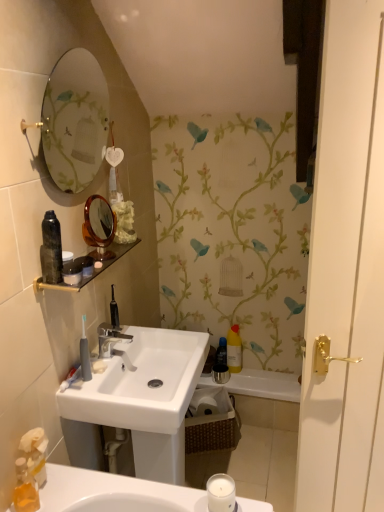
Identify the location of yellow matte bottle at center, marked as the 1th toiletry in a right-to-left arrangement. (234, 350).

Find the location of a particular element. gray rubber toothbrush at lower left, which is the first toiletry from top to bottom is located at coordinates (85, 354).

What do you see at coordinates (92, 272) in the screenshot?
I see `matte glass shelf at upper center` at bounding box center [92, 272].

Where is `translucent plastic soap dispenser at lower left`? translucent plastic soap dispenser at lower left is located at coordinates (25, 488).

You are a GUI agent. You are given a task and a screenshot of the screen. Output one action in this format:
    pyautogui.click(x=<x>, y=<y>)
    Task: Click on the white glossy door handle at right
    The height and width of the screenshot is (512, 384).
    Given the screenshot: What is the action you would take?
    pyautogui.click(x=346, y=271)

What is the approximate height of white glossy door handle at right?

white glossy door handle at right is 1.66 meters in height.

I want to click on yellow matte bottle at center, which ranks as the 2th toiletry in top-to-bottom order, so click(x=234, y=350).

The image size is (384, 512). What are the coordinates of `basket on the right of the silver metallic faucet at center` in the screenshot? It's located at (210, 432).

Would you say silver metallic faucet at center is to the left or to the right of woven brown basket at lower center in the picture?

In the image, silver metallic faucet at center appears on the left side of woven brown basket at lower center.

Is silver metallic faucet at center wider or thinner than woven brown basket at lower center?

silver metallic faucet at center is thinner than woven brown basket at lower center.

Is silver metallic faucet at center smaller than woven brown basket at lower center?

Yes, silver metallic faucet at center is smaller than woven brown basket at lower center.

Between satin gold mirror at upper center and white glossy bathtub at center, which one appears on the left side from the viewer's perspective?

Positioned to the left is satin gold mirror at upper center.

You are a GUI agent. You are given a task and a screenshot of the screen. Output one action in this format:
    pyautogui.click(x=<x>, y=<y>)
    Task: Click on the mirror above the white glossy bathtub at center (from a real-world perspective)
    The height and width of the screenshot is (512, 384).
    Given the screenshot: What is the action you would take?
    pyautogui.click(x=99, y=226)

Is satin gold mirror at upper center facing away from white glossy bathtub at center?

That's not correct — satin gold mirror at upper center is not looking away from white glossy bathtub at center.

Does satin gold mirror at upper center come in front of white glossy bathtub at center?

Yes, it is in front of white glossy bathtub at center.

Is white matte candle at lower center far away from white glossy sink at center?

That's not correct — white matte candle at lower center is a little close to white glossy sink at center.

Consider the image. Looking at the image, does white matte candle at lower center seem bigger or smaller compared to white glossy sink at center?

white matte candle at lower center is smaller than white glossy sink at center.

From the image's perspective, which one is positioned lower, white matte candle at lower center or white glossy sink at center?

white glossy sink at center.

Considering the relative sizes of white matte candle at lower center and white glossy sink at center in the image provided, is white matte candle at lower center wider than white glossy sink at center?

Incorrect, the width of white matte candle at lower center does not surpass that of white glossy sink at center.

Is there a large distance between matte glass shelf at upper center and translucent plastic soap dispenser at lower left?

No, matte glass shelf at upper center is not far away from translucent plastic soap dispenser at lower left.

Which of these two, matte glass shelf at upper center or translucent plastic soap dispenser at lower left, stands taller?

translucent plastic soap dispenser at lower left is taller.

Is matte glass shelf at upper center to the left or to the right of translucent plastic soap dispenser at lower left in the image?

Based on their positions, matte glass shelf at upper center is located to the right of translucent plastic soap dispenser at lower left.

Considering the points (84, 285) and (19, 496), which point is in front, point (84, 285) or point (19, 496)?

The point (19, 496) is in front.

How far apart are gray rubber toothbrush at lower left, the 2th toiletry in the right-to-left sequence, and translucent plastic soap dispenser at lower left?

The distance of gray rubber toothbrush at lower left, the 2th toiletry in the right-to-left sequence, from translucent plastic soap dispenser at lower left is 15.16 inches.

Can we say gray rubber toothbrush at lower left, which is counted as the second toiletry, starting from the back, lies outside translucent plastic soap dispenser at lower left?

Yes, gray rubber toothbrush at lower left, which is counted as the second toiletry, starting from the back, is outside of translucent plastic soap dispenser at lower left.

From the image's perspective, which one is positioned higher, gray rubber toothbrush at lower left, arranged as the second toiletry when ordered from the bottom, or translucent plastic soap dispenser at lower left?

From the image's view, gray rubber toothbrush at lower left, arranged as the second toiletry when ordered from the bottom, is above.

Find the location of `the 1st toiletry to the right when counting from the translucent plastic soap dispenser at lower left`. the 1st toiletry to the right when counting from the translucent plastic soap dispenser at lower left is located at coordinates (85, 354).

From a real-world perspective, which object stands above the other?

matte glass shelf at upper center, from a real-world perspective.

Who is bigger, white matte candle at lower center or matte glass shelf at upper center?

Bigger between the two is matte glass shelf at upper center.

Consider the image. How distant is white matte candle at lower center from matte glass shelf at upper center?

white matte candle at lower center is 31.71 inches away from matte glass shelf at upper center.

Could you tell me if white matte candle at lower center is turned towards matte glass shelf at upper center?

No, white matte candle at lower center is not turned towards matte glass shelf at upper center.

From a real-world perspective, is white glossy door handle at right positioned over white matte candle at lower center based on gravity?

Correct, in the physical world, white glossy door handle at right is higher than white matte candle at lower center.

From the image's perspective, is white glossy door handle at right under white matte candle at lower center?

Actually, white glossy door handle at right appears above white matte candle at lower center in the image.

Do you think white glossy door handle at right is within white matte candle at lower center, or outside of it?

The correct answer is: outside.

Between white glossy door handle at right and white matte candle at lower center, which one has less height?

With less height is white matte candle at lower center.

Locate an element on the screen. The width and height of the screenshot is (384, 512). tap above the woven brown basket at lower center (from the image's perspective) is located at coordinates (110, 339).

Where is `mirror on the left of white glossy bathtub at center`? Image resolution: width=384 pixels, height=512 pixels. mirror on the left of white glossy bathtub at center is located at coordinates tap(99, 226).

Considering their positions, is white glossy sink at center positioned closer to white glossy door handle at right than gray rubber toothbrush at lower left, the 2th toiletry in the right-to-left sequence?

The object closer to white glossy door handle at right is white glossy sink at center.

From the image, which object appears to be farther from white glossy sink at center, white glossy bathtub at center or matte glass shelf at upper center?

white glossy bathtub at center lies further to white glossy sink at center than the other object.

Estimate the real-world distances between objects in this image. Which object is further from translucent plastic soap dispenser at lower left, yellow matte bottle at center, which ranks as the 2th toiletry in top-to-bottom order, or white glossy bathtub at center?

The object further to translucent plastic soap dispenser at lower left is yellow matte bottle at center, which ranks as the 2th toiletry in top-to-bottom order.

Consider the image. Considering their positions, is white glossy sink at center positioned further to translucent plastic soap dispenser at lower left than white glossy door handle at right?

white glossy door handle at right is further to translucent plastic soap dispenser at lower left.

Considering their positions, is woven brown basket at lower center positioned closer to white glossy sink at center than gray rubber toothbrush at lower left, marked as the first toiletry in a front-to-back arrangement?

gray rubber toothbrush at lower left, marked as the first toiletry in a front-to-back arrangement, lies closer to white glossy sink at center than the other object.

From the image, which object appears to be farther from satin gold mirror at upper center, white matte candle at lower center or woven brown basket at lower center?

Based on the image, woven brown basket at lower center appears to be further to satin gold mirror at upper center.

When comparing their distances from translucent plastic soap dispenser at lower left, does matte glass shelf at upper center or gray rubber toothbrush at lower left, marked as the first toiletry in a front-to-back arrangement, seem closer?

Based on the image, gray rubber toothbrush at lower left, marked as the first toiletry in a front-to-back arrangement, appears to be nearer to translucent plastic soap dispenser at lower left.

Based on the photo, considering their positions, is silver metallic faucet at center positioned closer to satin gold mirror at upper center than woven brown basket at lower center?

silver metallic faucet at center is positioned closer to the anchor satin gold mirror at upper center.

The width and height of the screenshot is (384, 512). Identify the location of toiletry located between white glossy door handle at right and white glossy bathtub at center in the depth direction. (85, 354).

The height and width of the screenshot is (512, 384). I want to click on toiletry between matte glass shelf at upper center and yellow matte bottle at center, which is the second toiletry from front to back, along the z-axis, so click(85, 354).

Locate an element on the screen. The width and height of the screenshot is (384, 512). candle holder situated between matte glass shelf at upper center and white glossy door handle at right from left to right is located at coordinates (221, 493).

Locate an element on the screen. bath positioned between white glossy sink at center and yellow matte bottle at center, acting as the 1th toiletry starting from the bottom, from near to far is located at coordinates (265, 385).